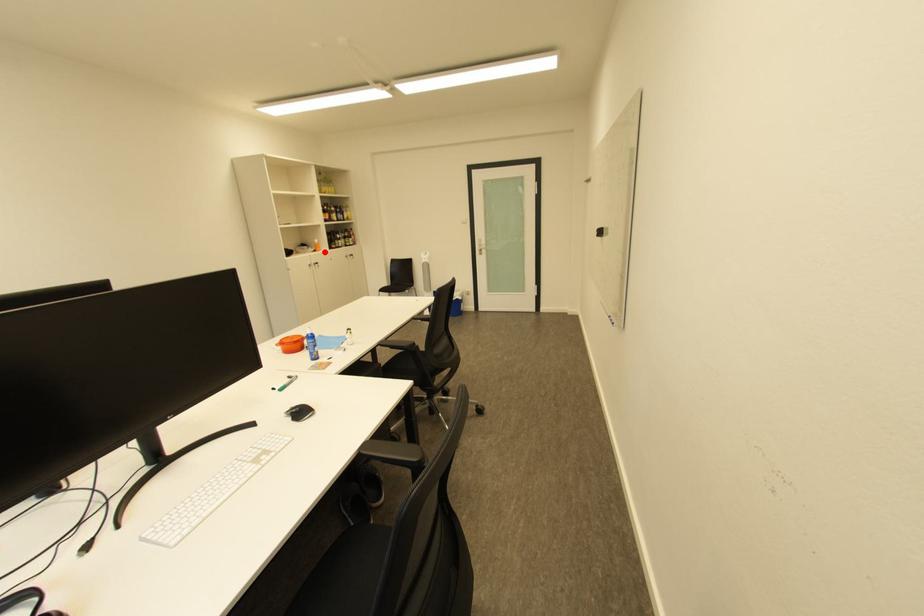
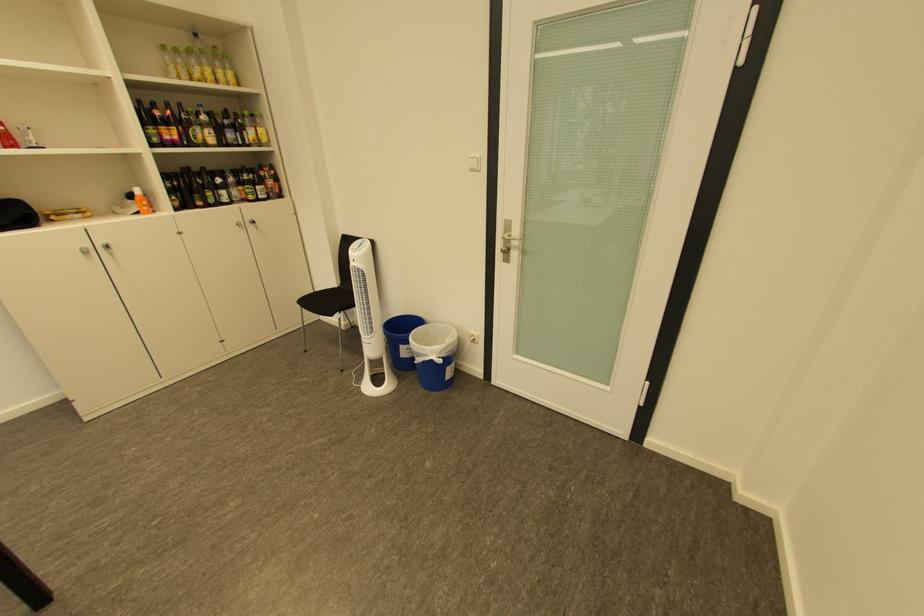
Where in the second image is the point corresponding to the highlighted location from the first image?

(148, 214)